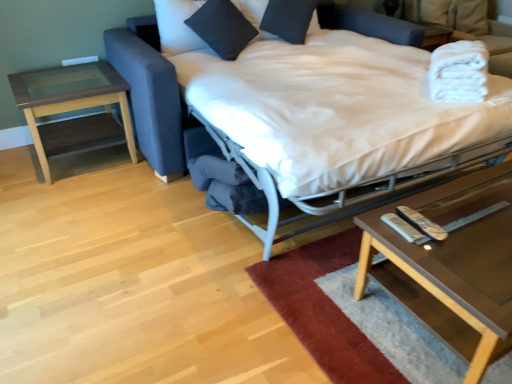
The width and height of the screenshot is (512, 384). I want to click on free space in front of brown wood/glass side table at left, so (36, 199).